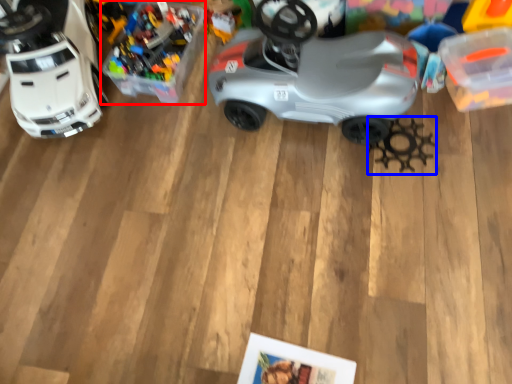
Question: Which point is closer to the camera, toy (highlighted by a red box) or toy (highlighted by a blue box)?

Choices:
 (A) toy
 (B) toy

Answer: (A)